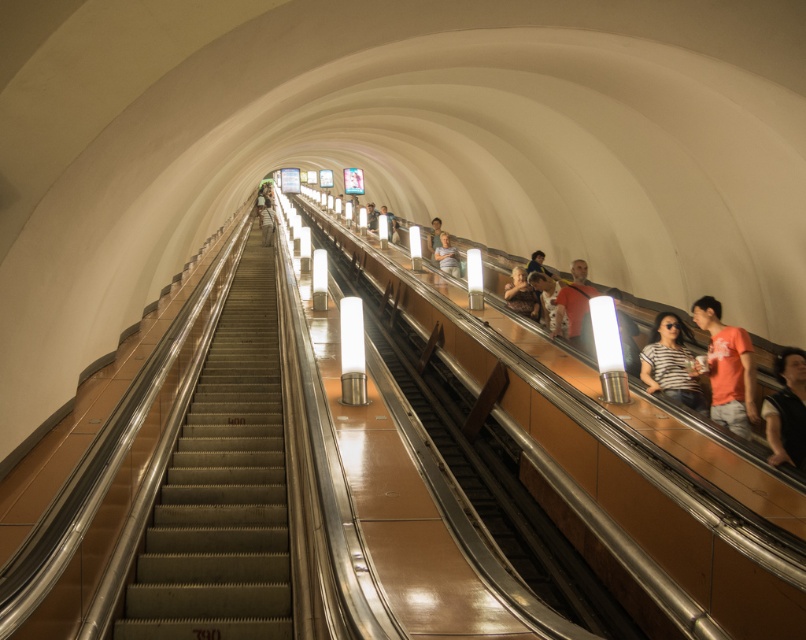
Question: Considering the real-world distances, which object is closest to the light brown leather jacket at upper center?

Choices:
 (A) smooth beige shirt at center
 (B) metallic gray stairs at center

Answer: (A)

Question: Does light blue shirt at center lie behind light brown leather jacket at upper center?

Choices:
 (A) yes
 (B) no

Answer: (B)

Question: Can you confirm if light blue shirt at center is positioned to the right of light brown leather jacket at upper center?

Choices:
 (A) no
 (B) yes

Answer: (B)

Question: Which is nearer to the light blue shirt at center?

Choices:
 (A) matte black jacket at upper center
 (B) light brown leather jacket at upper right
 (C) smooth beige shirt at center
 (D) orange cotton t-shirt at right

Answer: (A)

Question: Estimate the real-world distances between objects in this image. Which object is farther from the smooth beige shirt at center?

Choices:
 (A) light brown leather jacket at upper center
 (B) orange cotton t-shirt at right
 (C) matte black jacket at upper center
 (D) light brown leather jacket at upper right

Answer: (B)

Question: In this image, where is orange cotton t-shirt at right located relative to smooth beige shirt at center?

Choices:
 (A) below
 (B) above

Answer: (A)